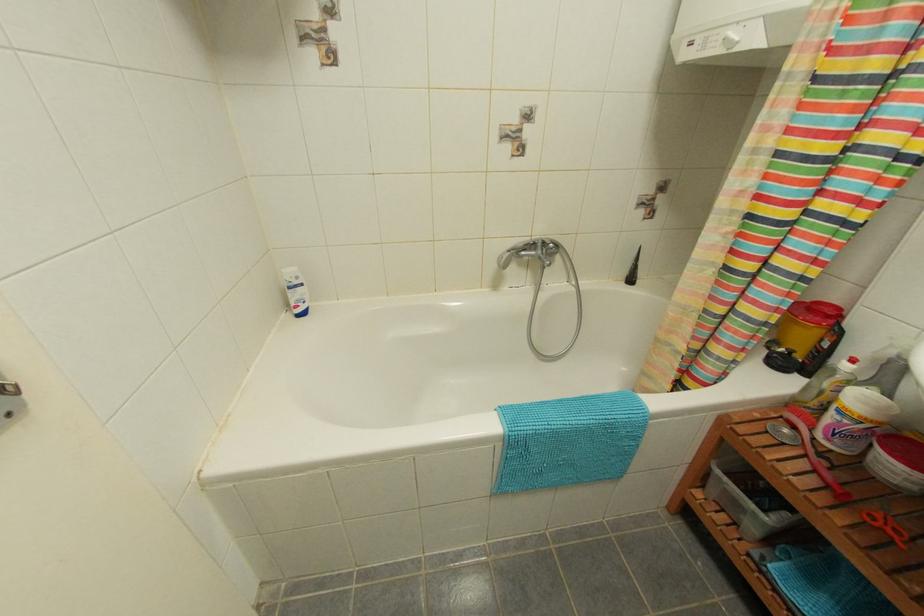
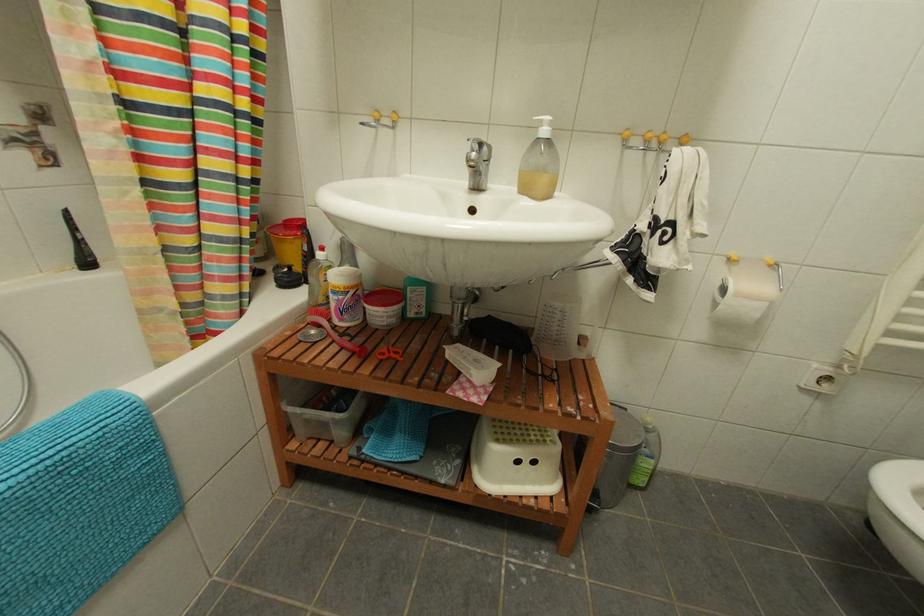
Question: Based on the continuous images, in which direction is the camera rotating? Reply with the corresponding letter.

Choices:
 (A) Left
 (B) Right
 (C) Up
 (D) Down

Answer: (B)